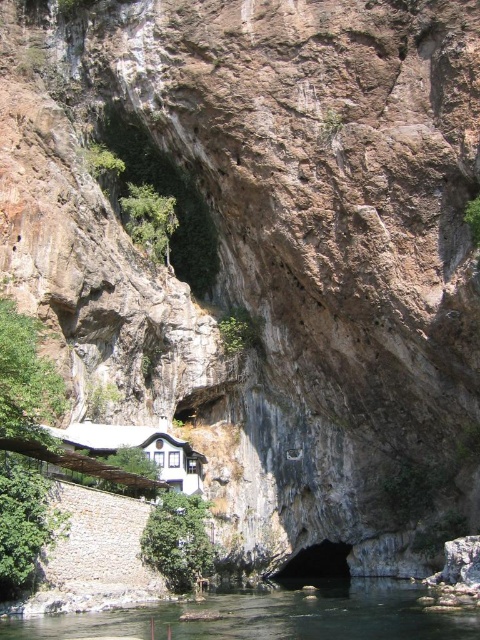
Question: In this image, where is clear water at lower center located relative to black rock cave at center?

Choices:
 (A) left
 (B) right

Answer: (A)

Question: Which object appears closest to the camera in this image?

Choices:
 (A) clear water at lower center
 (B) black rock cave at center

Answer: (A)

Question: Which object appears farthest from the camera in this image?

Choices:
 (A) white matte house at lower center
 (B) clear water at lower center
 (C) black rock cave at center

Answer: (C)

Question: Which of the following is the closest to the observer?

Choices:
 (A) white matte house at lower center
 (B) black rock cave at center
 (C) clear water at lower center

Answer: (C)

Question: Does white matte house at lower center lie in front of black rock cave at center?

Choices:
 (A) no
 (B) yes

Answer: (B)

Question: Can you confirm if white matte house at lower center is positioned to the right of black rock cave at center?

Choices:
 (A) no
 (B) yes

Answer: (A)